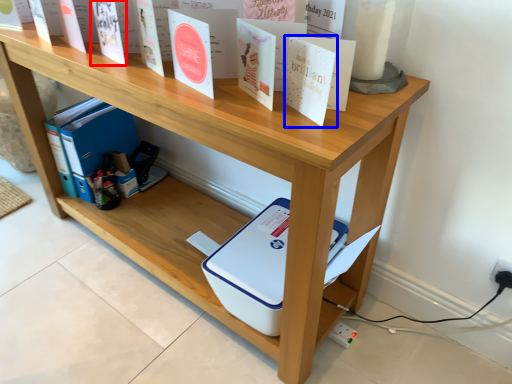
Question: Which object is further to the camera taking this photo, paperback book (highlighted by a red box) or paperback book (highlighted by a blue box)?

Choices:
 (A) paperback book
 (B) paperback book

Answer: (A)